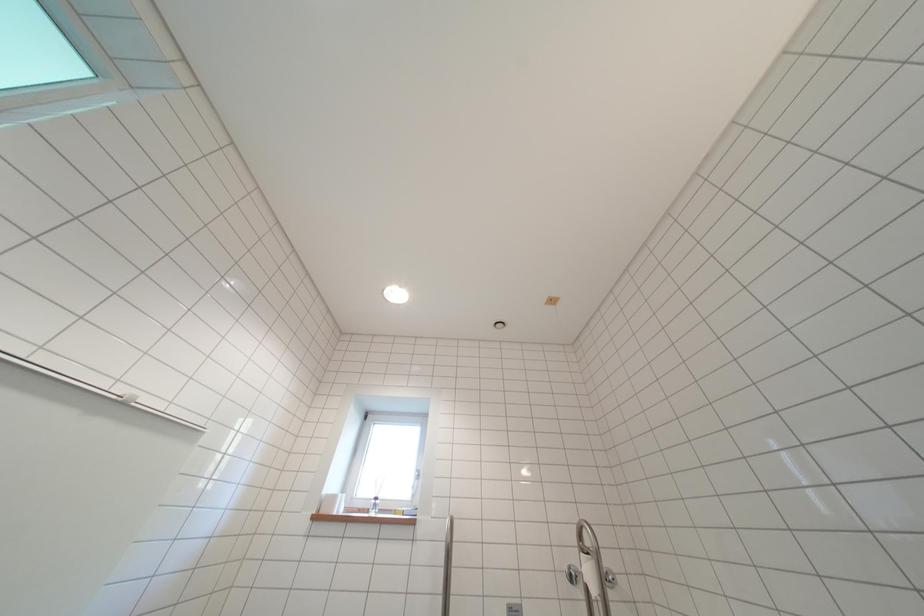
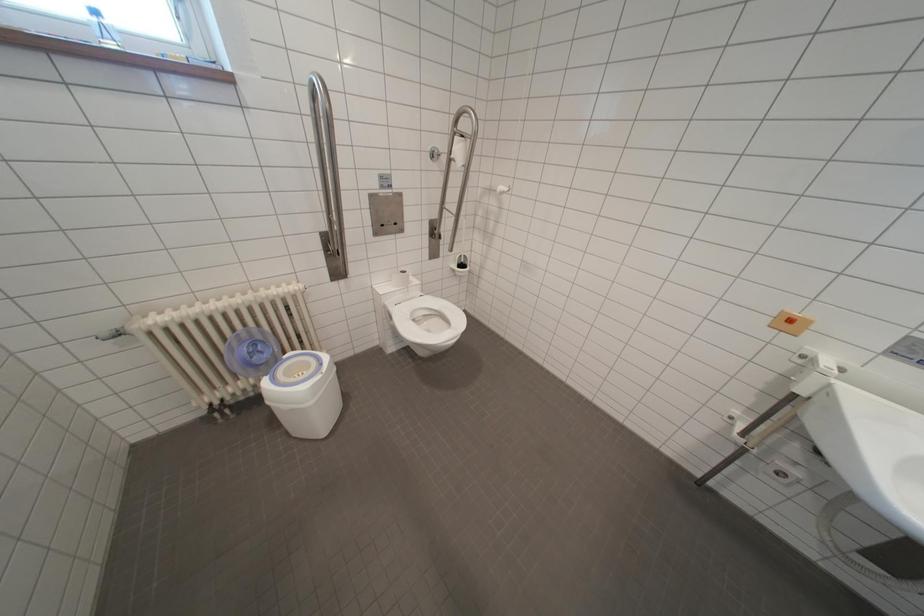
Based on the photo, based on the continuous images, in which direction is the camera rotating?

The camera's rotation is toward right-down.